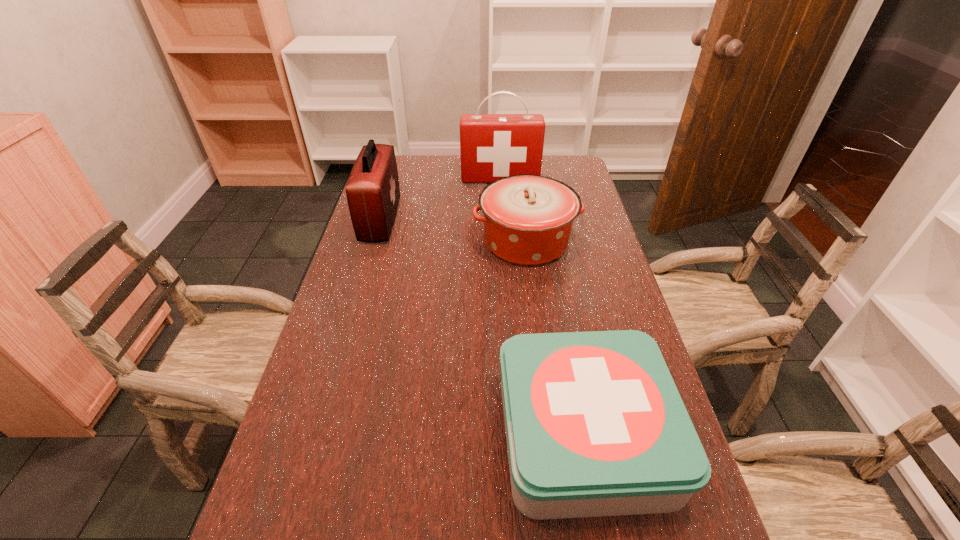
Identify the location of vacant area that lies between the second tallest first-aid kit and the nearest object. The height and width of the screenshot is (540, 960). (483, 328).

The width and height of the screenshot is (960, 540). Find the location of `free space between the third shortest object and the shortest first-aid kit`. free space between the third shortest object and the shortest first-aid kit is located at coordinates (483, 328).

The image size is (960, 540). I want to click on vacant space that is in between the tallest object and the nearest first-aid kit, so click(543, 308).

Identify the location of the closest object relative to the shortest first-aid kit. (528, 219).

Identify the location of object identified as the second closest to the shortest object. This screenshot has height=540, width=960. (372, 190).

Identify which first-aid kit is the closest to the tallest object. Please provide its 2D coordinates. Your answer should be formatted as a tuple, i.e. [(x, y)], where the tuple contains the x and y coordinates of a point satisfying the conditions above.

[(372, 190)]

Choose which first-aid kit is the nearest neighbor to the second tallest first-aid kit. Please provide its 2D coordinates. Your answer should be formatted as a tuple, i.e. [(x, y)], where the tuple contains the x and y coordinates of a point satisfying the conditions above.

[(492, 146)]

The height and width of the screenshot is (540, 960). I want to click on blank area in the image that satisfies the following two spatial constraints: 1. on the side of the shortest first-aid kit with the cross symbol; 2. on the right side of the leftmost object, so click(318, 436).

Identify the location of vacant area that satisfies the following two spatial constraints: 1. on the side of the leftmost object with the cross symbol; 2. on the right side of the casserole. (374, 241).

Where is `vacant space that satisfies the following two spatial constraints: 1. on the side of the second farthest first-aid kit with the cross symbol; 2. on the back side of the second shortest object`? This screenshot has width=960, height=540. vacant space that satisfies the following two spatial constraints: 1. on the side of the second farthest first-aid kit with the cross symbol; 2. on the back side of the second shortest object is located at coordinates (374, 241).